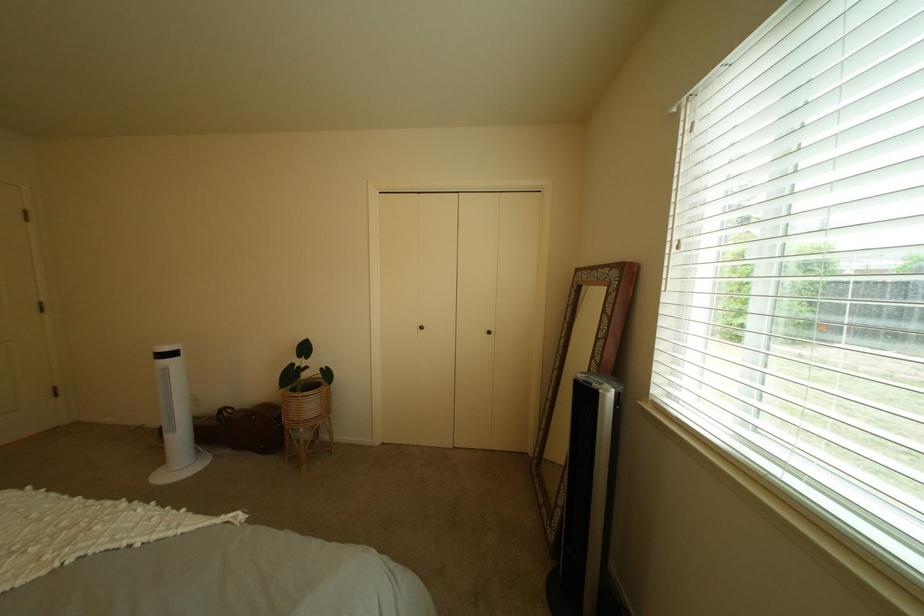
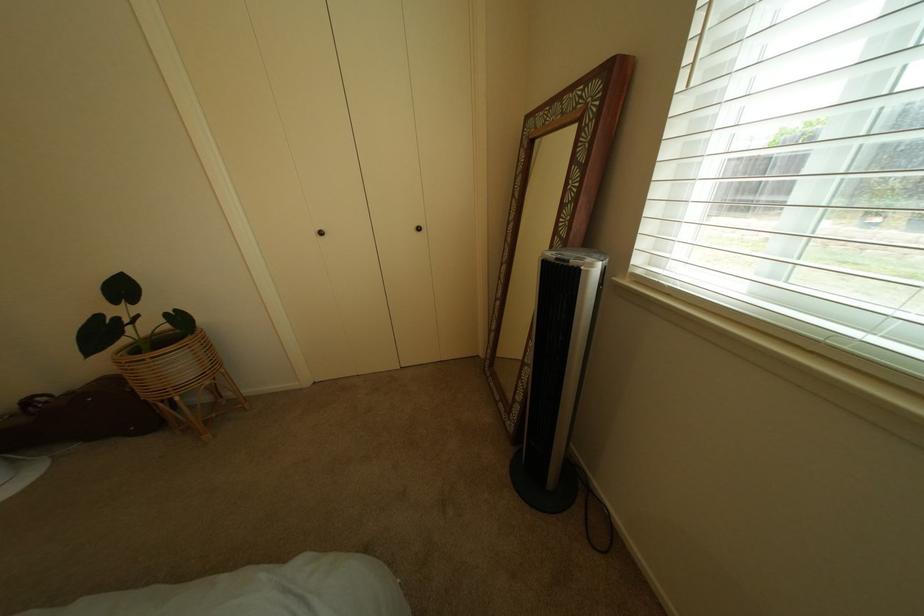
In the second image, find the point that corresponds to (x=318, y=398) in the first image.

(167, 359)